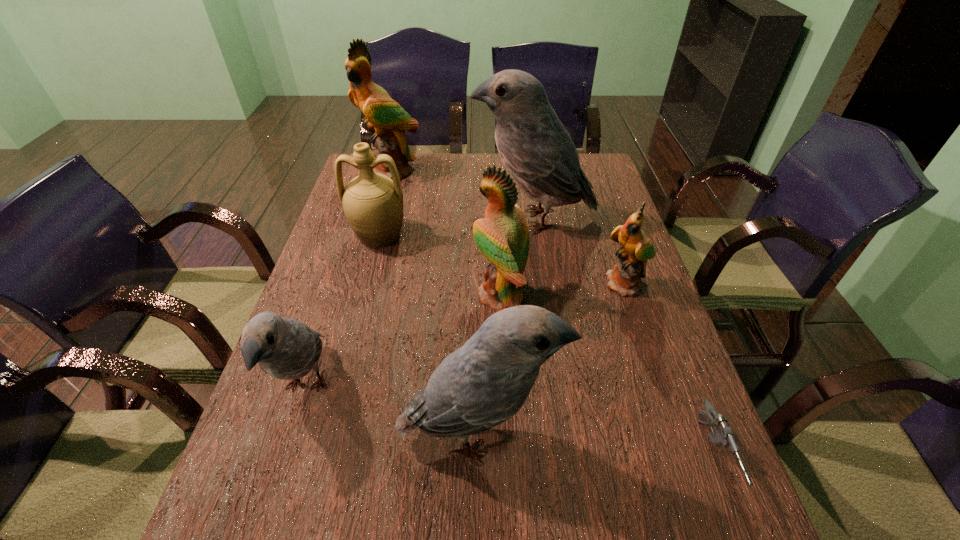
Find the location of a particular element. The height and width of the screenshot is (540, 960). free spot located 0.140m on the front-facing side of the fifth nearest parrot is located at coordinates (426, 219).

The image size is (960, 540). In order to click on vacant space located 0.130m on the front-facing side of the fifth nearest parrot in this screenshot , I will do `click(429, 219)`.

Identify the location of vacant position located 0.240m on the front-facing side of the fifth nearest parrot. (394, 219).

Locate an element on the screen. Image resolution: width=960 pixels, height=540 pixels. vacant space located on the front-facing side of the farthest green parrot is located at coordinates (383, 202).

Locate an element on the screen. This screenshot has height=540, width=960. vacant space located on the front-facing side of the second green parrot from right to left is located at coordinates (366, 295).

You are a GUI agent. You are given a task and a screenshot of the screen. Output one action in this format:
    pyautogui.click(x=<x>, y=<y>)
    Task: Click on the free point located 0.090m on the front-facing side of the second green parrot from right to left
    
    Given the screenshot: What is the action you would take?
    pyautogui.click(x=439, y=295)

Image resolution: width=960 pixels, height=540 pixels. Identify the location of vacant position located on the front-facing side of the second green parrot from right to left. coord(435,295).

Find the location of a particular element. The width and height of the screenshot is (960, 540). free region located on the front-facing side of the second smallest gray parrot is located at coordinates (664, 435).

The height and width of the screenshot is (540, 960). In order to click on blank space located on the back of the pitcher in this screenshot , I will do `click(387, 205)`.

The image size is (960, 540). I want to click on vacant space situated on the front-facing side of the rightmost green parrot, so click(x=644, y=340).